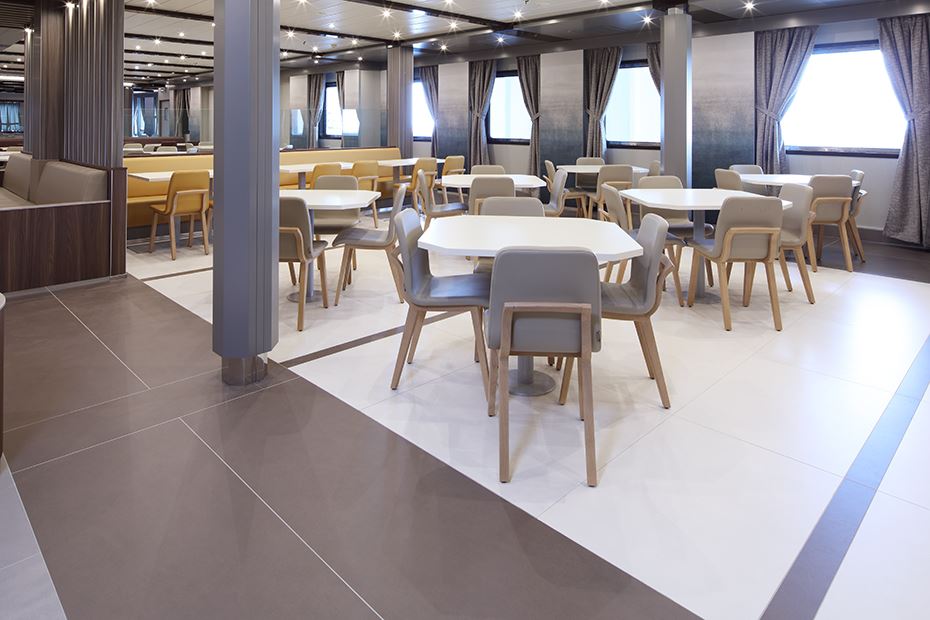
Find the location of a particular element. tables is located at coordinates (482, 229), (522, 179), (579, 167), (679, 192), (786, 178), (347, 200), (401, 161), (300, 167), (153, 175), (161, 153).